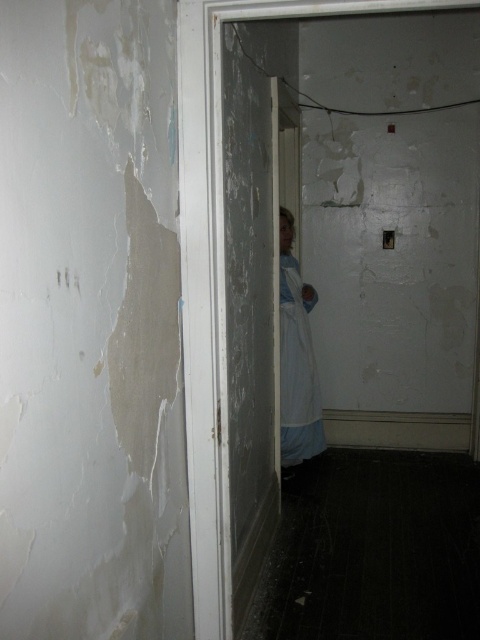
You are a painter who needs to decide whether to paint the white matte door at center first or the white fabric dress at center. Since you can only paint one at a time, which object should you paint first based on their height?

The white matte door at center is taller than the white fabric dress at center, so you should paint the white matte door at center first as it requires more attention due to its height.

You are a delivery person holding a box that is 1.5 meters long. You are standing in front of the white matte door at center. Can you fit the box through the doorway without tilting it?

The white matte door at center is 1.48 meters from camera. Since the box is 1.5 meters long, it is slightly longer than the distance available, so it might not fit without tilting or adjusting the position.

In the scene shown: You are standing in the doorway of this dimly lit room and notice the white matte door at center and the white fabric dress at center. Which object is nearer to you as you face the room?

The white matte door at center is closer to the viewer than the white fabric dress at center, so the door is nearer to you.